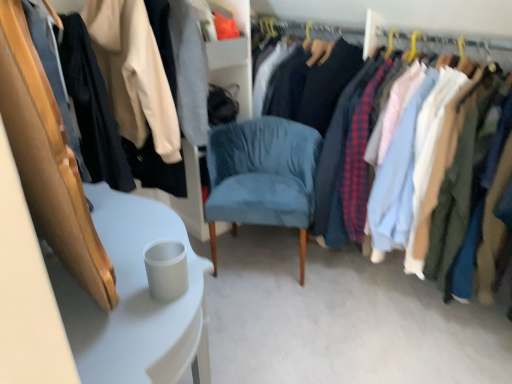
Question: Looking at their shapes, would you say matte fabric shirts at right, the 1th closet viewed from the right, is wider or thinner than suede blue chair at center?

Choices:
 (A) wide
 (B) thin

Answer: (A)

Question: Considering the positions of matte fabric shirts at right, the 1th closet viewed from the right, and suede blue chair at center in the image, is matte fabric shirts at right, the 1th closet viewed from the right, bigger or smaller than suede blue chair at center?

Choices:
 (A) small
 (B) big

Answer: (B)

Question: Based on their relative distances, which object is farther from the suede blue chair at center?

Choices:
 (A) matte fabric shirts at right, the 2th closet when ordered from left to right
 (B) matte black jacket at upper left, positioned as the 1th closet in left-to-right order
 (C) white glossy table at lower left

Answer: (B)

Question: Which object is positioned closest to the white glossy table at lower left?

Choices:
 (A) matte black jacket at upper left, positioned as the 1th closet in left-to-right order
 (B) suede blue chair at center
 (C) matte fabric shirts at right, the 2th closet when ordered from left to right

Answer: (A)